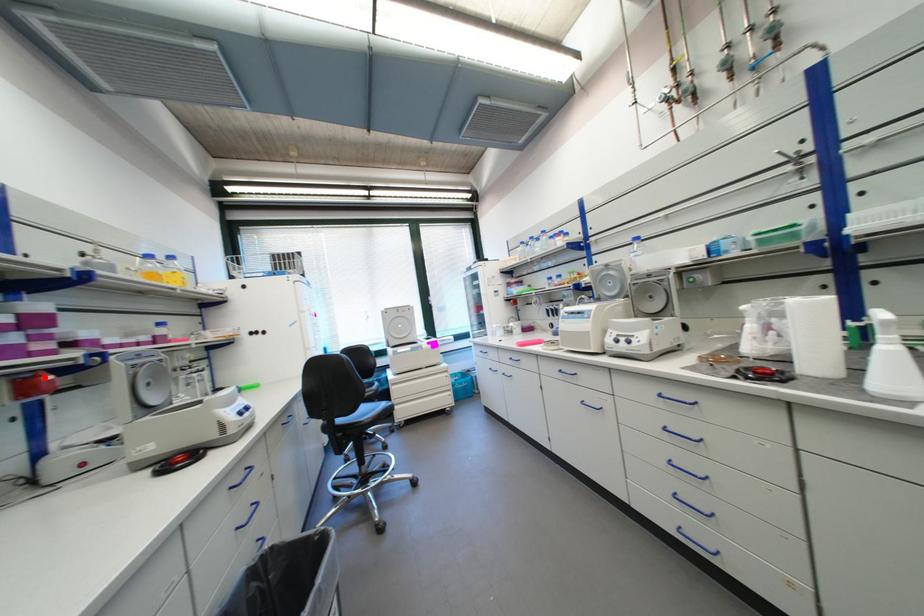
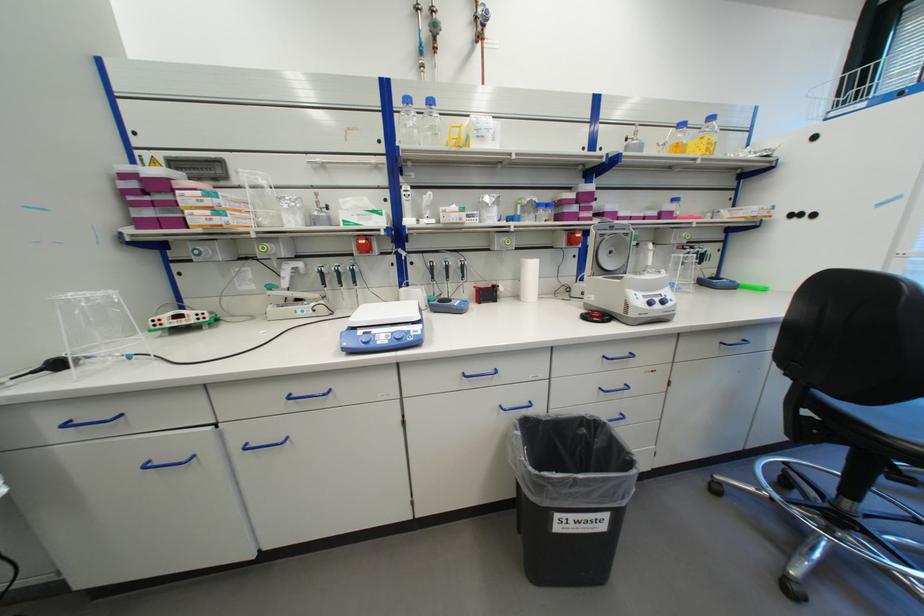
Locate, in the second image, the point that corresponds to the highlighted location in the first image.

(581, 235)